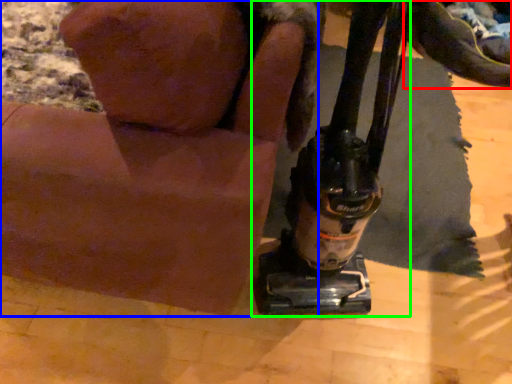
Question: Which object is positioned closest to footwear (highlighted by a red box)? Select from animal (highlighted by a blue box) and sewing machine (highlighted by a green box).

Choices:
 (A) animal
 (B) sewing machine

Answer: (B)